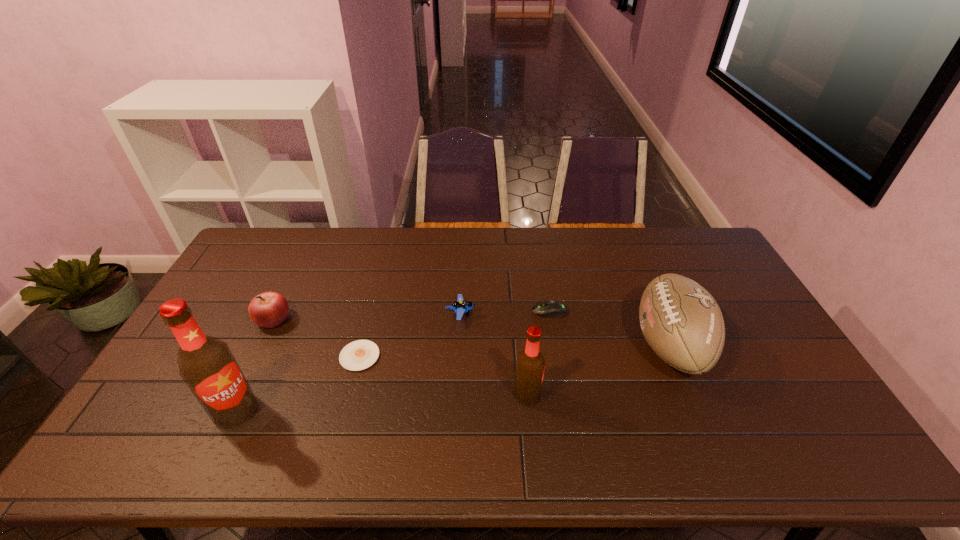
The width and height of the screenshot is (960, 540). Find the location of `the third object from left to right`. the third object from left to right is located at coordinates (358, 355).

This screenshot has height=540, width=960. I want to click on computer mouse, so [x=550, y=308].

This screenshot has height=540, width=960. I want to click on the sixth tallest object, so click(x=550, y=308).

Locate an element on the screen. Image resolution: width=960 pixels, height=540 pixels. vacant space located 0.210m on the right of the tallest object is located at coordinates (339, 410).

Image resolution: width=960 pixels, height=540 pixels. I want to click on vacant space located 0.380m on the back of the fifth object from left to right, so click(x=517, y=289).

You are a GUI agent. You are given a task and a screenshot of the screen. Output one action in this format:
    pyautogui.click(x=<x>, y=<y>)
    Task: Click on the vacant space located 0.390m on the front-facing side of the Lego
    This screenshot has height=540, width=960.
    Given the screenshot: What is the action you would take?
    [598, 314]

Image resolution: width=960 pixels, height=540 pixels. Find the location of `vacant space situated 0.190m on the laces of the football (American)`. vacant space situated 0.190m on the laces of the football (American) is located at coordinates (569, 345).

The height and width of the screenshot is (540, 960). I want to click on vacant region located 0.270m on the laces of the football (American), so click(x=542, y=345).

Identify the location of free spot located 0.110m on the laces of the football (American). (597, 345).

Identify the location of vacant region located on the back of the fourth shortest object. (303, 256).